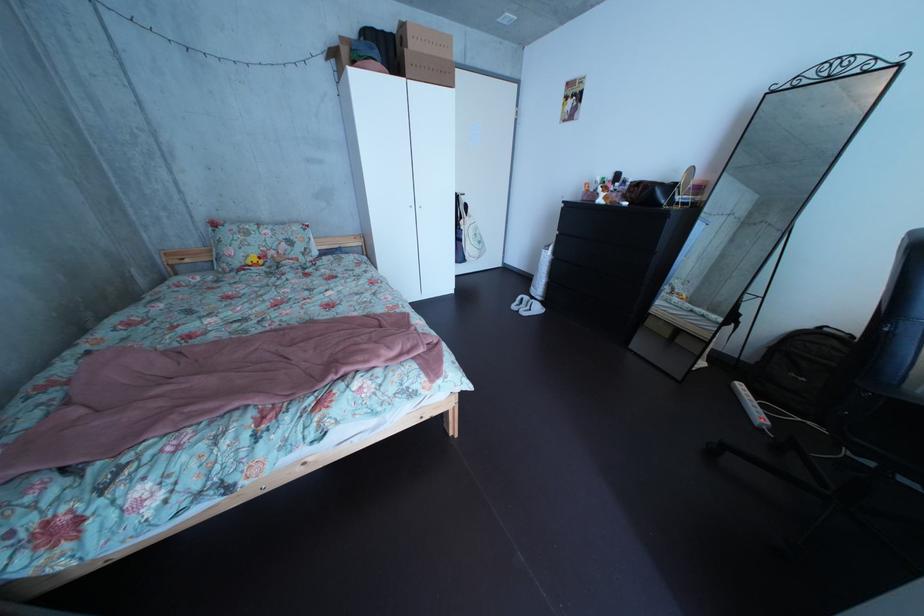
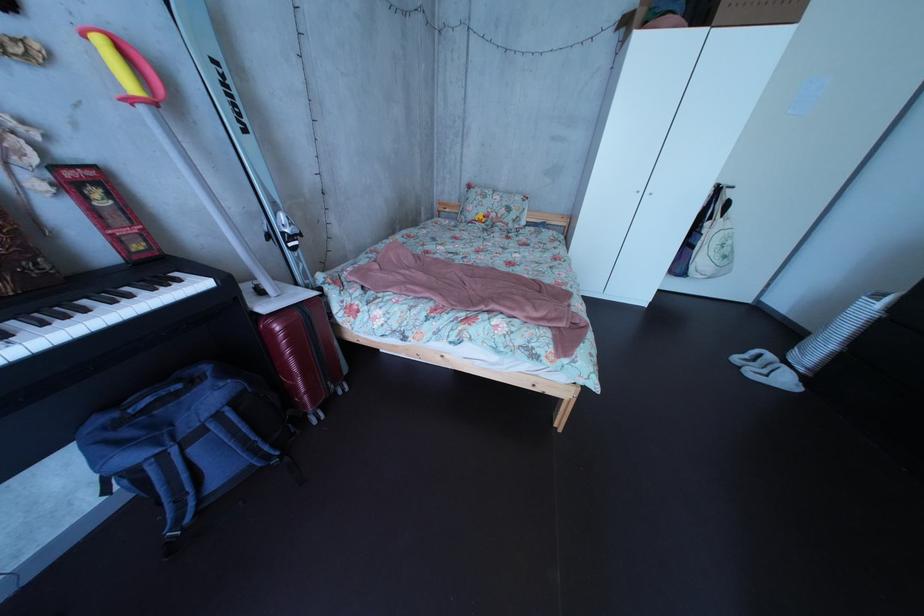
Locate, in the second image, the point that corresponds to point (541, 306) in the first image.

(784, 363)